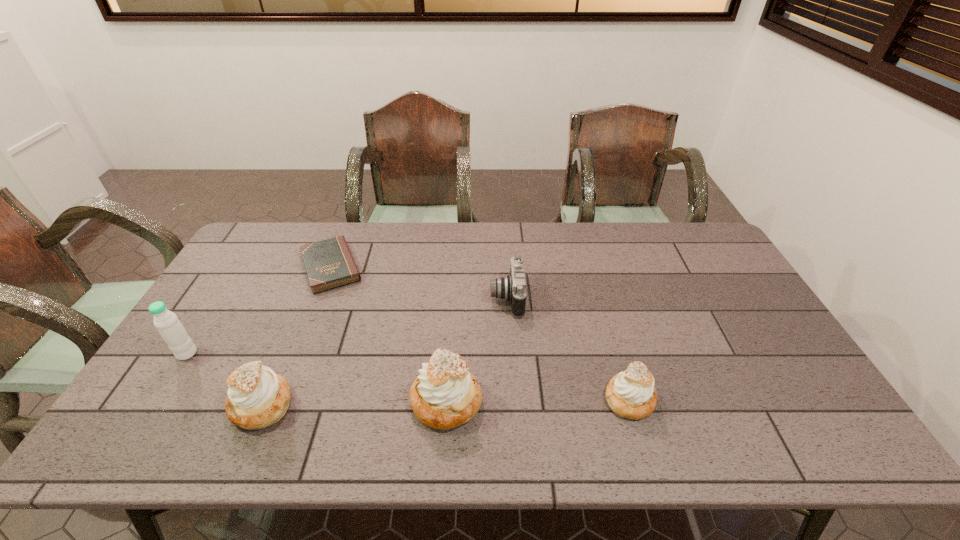
At what (x,y) coordinates should I click in order to perform the action: click on unoccupied area between the second object from right to left and the leftmost object. Please return your answer as a coordinate pair (x, y). Looking at the image, I should click on (347, 326).

Identify which object is the second nearest to the rightmost pastry. Please provide its 2D coordinates. Your answer should be formatted as a tuple, i.e. [(x, y)], where the tuple contains the x and y coordinates of a point satisfying the conditions above.

[(445, 395)]

This screenshot has width=960, height=540. What are the coordinates of `object that stands as the second closest to the second object from right to left` in the screenshot? It's located at (631, 394).

The image size is (960, 540). I want to click on the closest pastry to the second shortest pastry, so click(x=445, y=395).

Find the location of a particular element. The width and height of the screenshot is (960, 540). pastry that stands as the third closest to the camera is located at coordinates (257, 398).

The height and width of the screenshot is (540, 960). I want to click on vacant space that satisfies the following two spatial constraints: 1. on the front side of the third farthest object; 2. on the right side of the rightmost pastry, so click(x=157, y=399).

This screenshot has width=960, height=540. Find the location of `blank area in the image that satisfies the following two spatial constraints: 1. on the front-facing side of the fifth object from left to right; 2. on the front side of the third object from right to left`. blank area in the image that satisfies the following two spatial constraints: 1. on the front-facing side of the fifth object from left to right; 2. on the front side of the third object from right to left is located at coordinates (514, 402).

You are a GUI agent. You are given a task and a screenshot of the screen. Output one action in this format:
    pyautogui.click(x=<x>, y=<y>)
    Task: Click on the vacant region that satisfies the following two spatial constraints: 1. on the front side of the Bible; 2. on the left side of the second pastry from left to right
    Image resolution: width=960 pixels, height=540 pixels.
    Given the screenshot: What is the action you would take?
    pyautogui.click(x=277, y=402)

The height and width of the screenshot is (540, 960). Identify the location of vacant region that satisfies the following two spatial constraints: 1. on the back side of the shortest pastry; 2. on the left side of the leftmost pastry. (264, 399).